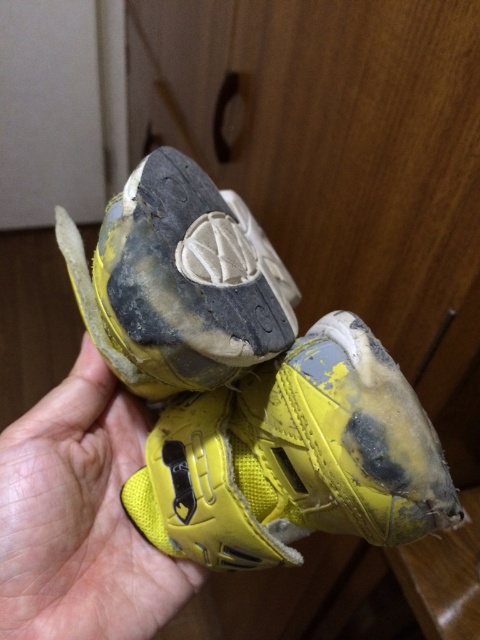
You are an interior designer assessing the placement of furniture in a room. You notice the yellow fabric shoe at center in the image. Based on its position at coordinates, can you determine if it is placed closer to the left or right side of the room?

The yellow fabric shoe at center is located at coordinates (295, 458). Since the x coordinate is 0.716, which is closer to 1.0 than 0.0, it is positioned closer to the right side of the room.

You are holding two yellow shoes in your hands. According to the image, which one is positioned lower between the yellow fabric shoe at center and the yellow matte shoe at center?

The yellow fabric shoe at center is positioned lower than the yellow matte shoe at center.

You are holding the yellow fabric shoe at center and the yellow fabric hand at center is part of your own hand. To place the shoe back into the wardrobe behind you, which direction should you move the shoe relative to your hand?

You should move the yellow fabric shoe at center to the left of the yellow fabric hand at center since the shoe is currently to the right of it, and moving it left would align it towards the wardrobe door visible in the background.